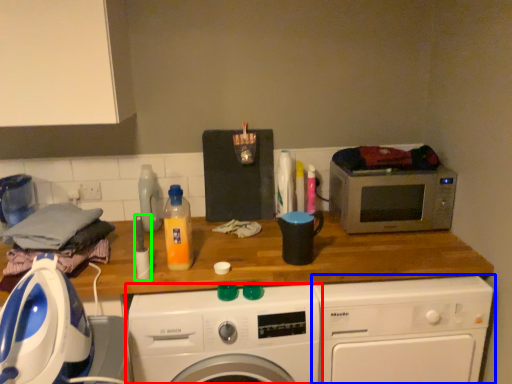
Question: Which is farther away from washing machine (highlighted by a red box)? washing machine (highlighted by a blue box) or appliance (highlighted by a green box)?

Choices:
 (A) washing machine
 (B) appliance

Answer: (B)